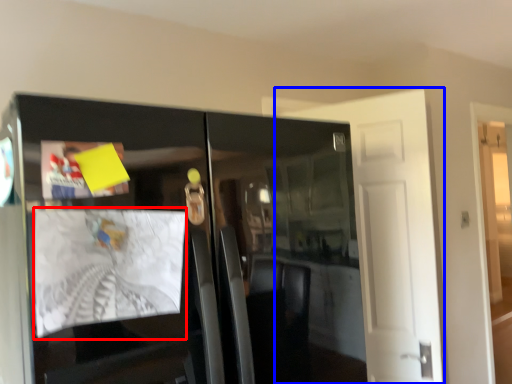
Question: Among these objects, which one is farthest to the camera, magazine (highlighted by a red box) or door (highlighted by a blue box)?

Choices:
 (A) magazine
 (B) door

Answer: (B)